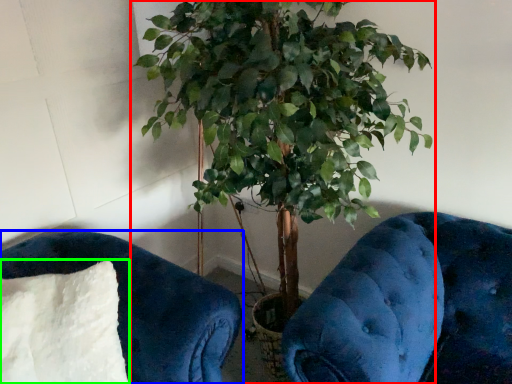
Question: Which is nearer to the houseplant (highlighted by a red box)? furniture (highlighted by a blue box) or pillow (highlighted by a green box).

Choices:
 (A) furniture
 (B) pillow

Answer: (A)